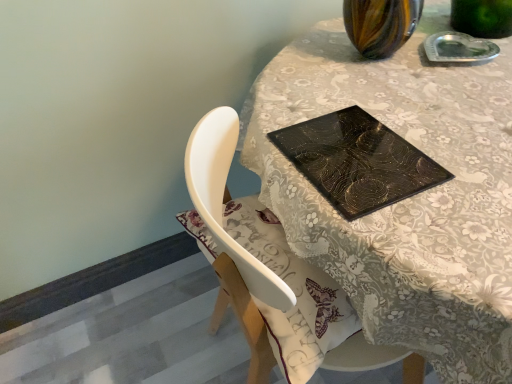
Where is `free point behind black glossy placemat at upper center`? The width and height of the screenshot is (512, 384). free point behind black glossy placemat at upper center is located at coordinates (333, 106).